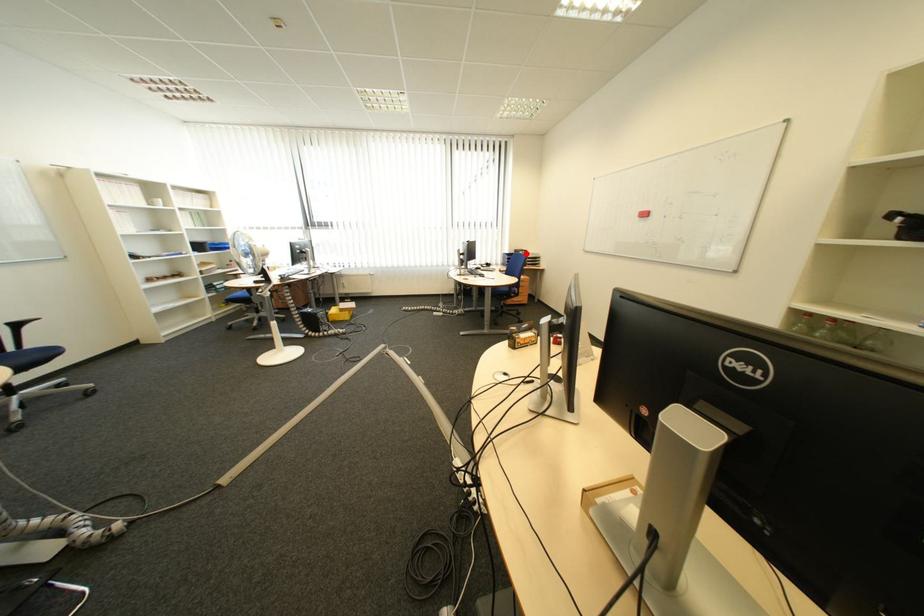
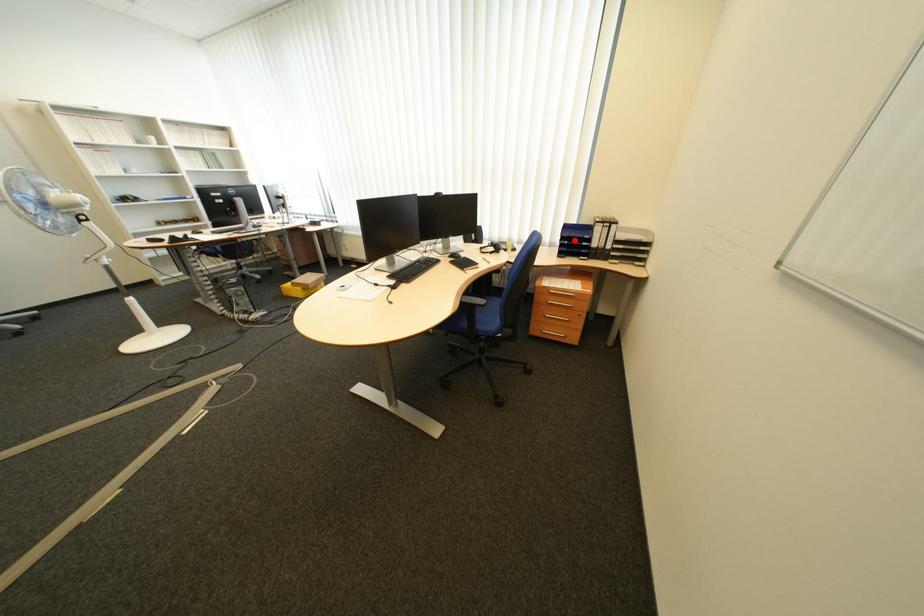
I am providing you with two images of the same scene from different viewpoints. A red point is marked on the first image and another point is marked on the second image. Does the point marked in image1 correspond to the same location as the one in image2?

No